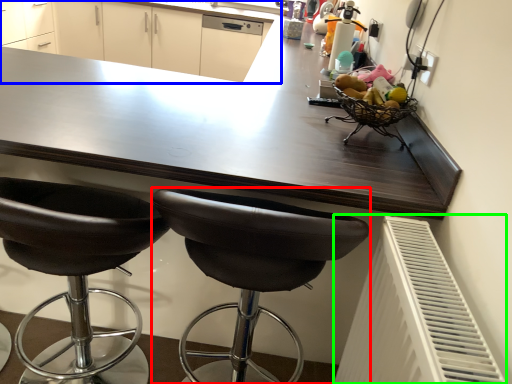
Question: Which object is positioned closest to chair (highlighted by a red box)? Select from cabinetry (highlighted by a blue box) and radiator (highlighted by a green box).

Choices:
 (A) cabinetry
 (B) radiator

Answer: (B)